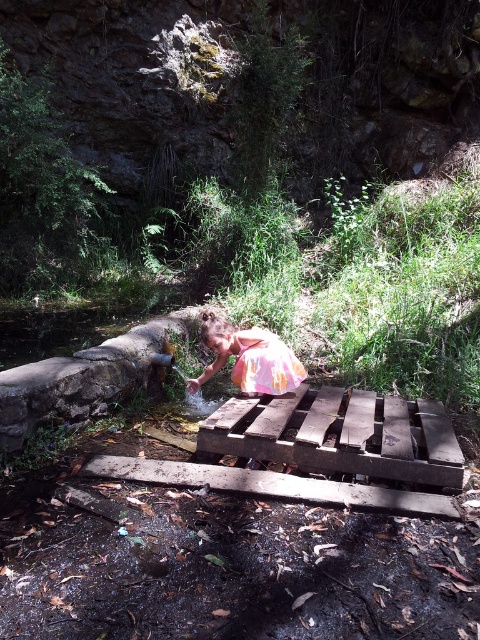
You are a construction worker assessing the stability of the wooden structure in the image. The weathered brown wood at center and the wooden plank at center are key components. Which component has a greater width, and how might this affect their load capacity?

The wooden plank at center has a greater width than the weathered brown wood at center. A wider plank generally provides better load capacity and stability, so the wooden plank at center can support more weight compared to the narrower weathered brown wood at center.

You are standing at the origin point of the coordinate system in the image. Where is the weathered brown wood at center located in terms of coordinates?

The weathered brown wood at center is located at coordinates point (339, 435).

You are a hiker who wants to cross the wooden structure to reach the other side. The wooden plank at center is located at point (273, 484). Is the wooden plank at center safe to step on?

The wooden plank at center is located at point (273, 484), so yes, it is safe to step on the wooden plank at center as it is part of the wooden structure designed for crossing.